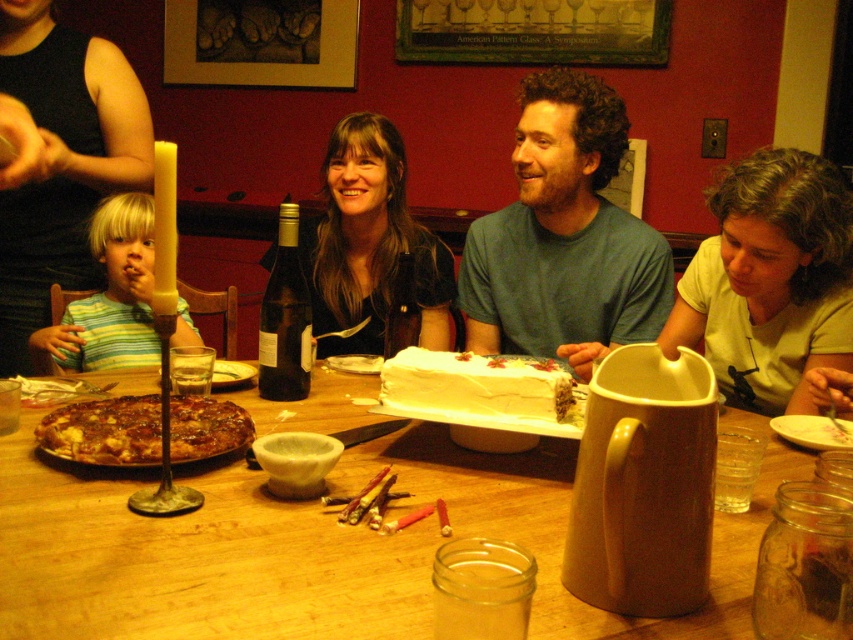
Which is more to the left, wooden table at center or green cotton shirt at upper center?

Positioned to the left is wooden table at center.

Is point (363, 385) behind point (543, 150)?

No, (363, 385) is in front of (543, 150).

Where is `wooden table at center`? wooden table at center is located at coordinates (322, 545).

Between wooden table at center and smooth white cake at center, which one has more height?

smooth white cake at center

Which is behind, point (366, 600) or point (387, 35)?

The point (387, 35) is more distant.

Identify the location of wooden table at center. Image resolution: width=853 pixels, height=640 pixels. click(322, 545).

Is green cotton shirt at upper center bigger than striped cotton shirt at left?

Correct, green cotton shirt at upper center is larger in size than striped cotton shirt at left.

Who is more distant from viewer, (618, 156) or (189, 340)?

The point (618, 156) is more distant.

Locate an element on the screen. green cotton shirt at upper center is located at coordinates (564, 236).